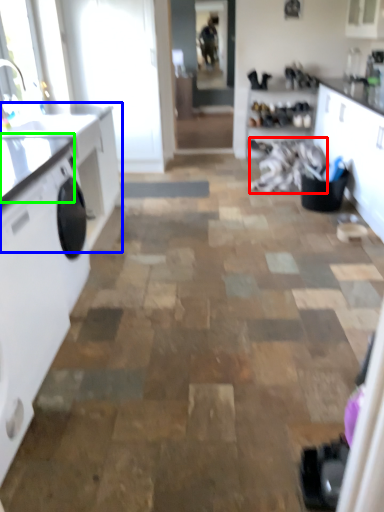
Question: Based on their relative distances, which object is farther from laundry (highlighted by a red box)? Choose from countertop (highlighted by a blue box) and counter top (highlighted by a green box).

Choices:
 (A) countertop
 (B) counter top

Answer: (B)